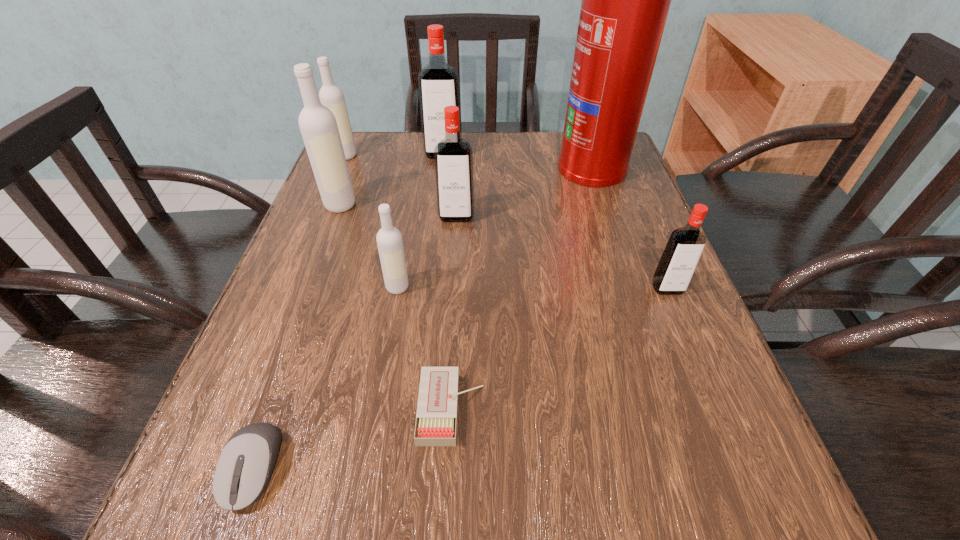
Locate an element on the screen. white vodka that is the second nearest to the shortest object is located at coordinates (318, 126).

The width and height of the screenshot is (960, 540). I want to click on white vodka object that ranks as the closest to the second smallest red vodka, so click(x=389, y=240).

Locate which red vodka ranks third in proximity to the shortest object. Please provide its 2D coordinates. Your answer should be formatted as a tuple, i.e. [(x, y)], where the tuple contains the x and y coordinates of a point satisfying the conditions above.

[(438, 82)]

Identify the location of red vodka that is the second closest to the nearest red vodka. (438, 82).

This screenshot has width=960, height=540. What are the coordinates of `vacant position in the image that satisfies the following two spatial constraints: 1. on the instruction side of the fire extinguisher; 2. on the front and back of the second biggest red vodka` in the screenshot? It's located at (608, 217).

Locate an element on the screen. The height and width of the screenshot is (540, 960). vacant space that satisfies the following two spatial constraints: 1. on the instruction side of the fire extinguisher; 2. on the front and back of the second smallest red vodka is located at coordinates (608, 217).

Locate an element on the screen. free space that satisfies the following two spatial constraints: 1. on the striking surface of the white matchbox; 2. on the wheel side of the second shortest object is located at coordinates (448, 468).

Where is `free spot that satisfies the following two spatial constraints: 1. on the instruction side of the red fire extinguisher; 2. on the front and back of the second smallest red vodka`? This screenshot has height=540, width=960. free spot that satisfies the following two spatial constraints: 1. on the instruction side of the red fire extinguisher; 2. on the front and back of the second smallest red vodka is located at coordinates (608, 217).

Where is `free space that satisfies the following two spatial constraints: 1. on the instruction side of the tallest object; 2. on the front and back of the second biggest red vodka`? free space that satisfies the following two spatial constraints: 1. on the instruction side of the tallest object; 2. on the front and back of the second biggest red vodka is located at coordinates pyautogui.click(x=608, y=217).